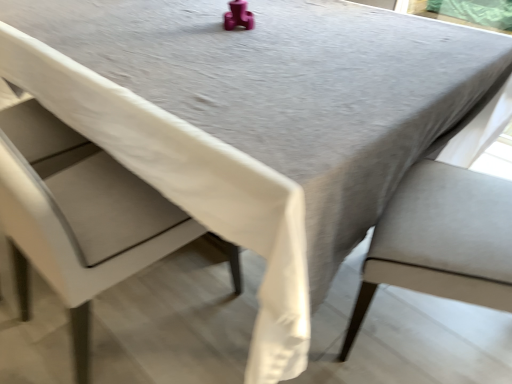
What do you see at coordinates (140, 195) in the screenshot?
I see `white fabric chair at left, which is counted as the first chair, starting from the left` at bounding box center [140, 195].

Locate an element on the screen. The height and width of the screenshot is (384, 512). white fabric chair at left, which is the second chair from right to left is located at coordinates (140, 195).

Find the location of a particular element. satin beige chair at right, marked as the 1th chair in a right-to-left arrangement is located at coordinates (441, 241).

This screenshot has height=384, width=512. What do you see at coordinates (441, 241) in the screenshot? I see `satin beige chair at right, which appears as the second chair when viewed from the left` at bounding box center [441, 241].

From the picture: How much space does satin beige chair at right, marked as the 1th chair in a right-to-left arrangement, occupy horizontally?

satin beige chair at right, marked as the 1th chair in a right-to-left arrangement, is 52.15 centimeters in width.

In order to face satin beige chair at right, marked as the 1th chair in a right-to-left arrangement, should I rotate leftwards or rightwards?

Rotate right and turn 28.306 degrees.

At what (x,y) coordinates should I click in order to perform the action: click on white fabric chair at left, which is counted as the first chair, starting from the left. Please return your answer as a coordinate pair (x, y). Looking at the image, I should click on (140, 195).

Which object is positioned more to the right, white fabric chair at left, which is counted as the first chair, starting from the left, or satin beige chair at right, marked as the 1th chair in a right-to-left arrangement?

Positioned to the right is satin beige chair at right, marked as the 1th chair in a right-to-left arrangement.

Does white fabric chair at left, which is counted as the first chair, starting from the left, come behind satin beige chair at right, which appears as the second chair when viewed from the left?

That is False.

Is point (86, 240) positioned behind point (468, 236)?

No, it is not.

From the image's perspective, who appears lower, white fabric chair at left, which is counted as the first chair, starting from the left, or satin beige chair at right, which appears as the second chair when viewed from the left?

satin beige chair at right, which appears as the second chair when viewed from the left, is shown below in the image.

From a real-world perspective, relative to satin beige chair at right, marked as the 1th chair in a right-to-left arrangement, is white fabric chair at left, which is counted as the first chair, starting from the left, vertically above or below?

From a real-world perspective, white fabric chair at left, which is counted as the first chair, starting from the left, is physically above satin beige chair at right, marked as the 1th chair in a right-to-left arrangement.

Between white fabric chair at left, which is the second chair from right to left, and satin beige chair at right, which appears as the second chair when viewed from the left, which one has larger width?

white fabric chair at left, which is the second chair from right to left, is wider.

Can you confirm if white fabric chair at left, which is counted as the first chair, starting from the left, is taller than satin beige chair at right, which appears as the second chair when viewed from the left?

Yes.

Based on their sizes in the image, would you say white fabric chair at left, which is counted as the first chair, starting from the left, is bigger or smaller than satin beige chair at right, which appears as the second chair when viewed from the left?

Considering their sizes, white fabric chair at left, which is counted as the first chair, starting from the left, takes up more space than satin beige chair at right, which appears as the second chair when viewed from the left.

Is satin beige chair at right, which appears as the second chair when viewed from the left, located within white fabric chair at left, which is the second chair from right to left?

No, satin beige chair at right, which appears as the second chair when viewed from the left, is not inside white fabric chair at left, which is the second chair from right to left.

Looking at this image, is white fabric chair at left, which is the second chair from right to left, not close to satin beige chair at right, which appears as the second chair when viewed from the left?

No, white fabric chair at left, which is the second chair from right to left, is in close proximity to satin beige chair at right, which appears as the second chair when viewed from the left.

Does white fabric chair at left, which is counted as the first chair, starting from the left, turn towards satin beige chair at right, marked as the 1th chair in a right-to-left arrangement?

No.

Based on the photo, could you measure the distance between white fabric chair at left, which is counted as the first chair, starting from the left, and satin beige chair at right, marked as the 1th chair in a right-to-left arrangement?

white fabric chair at left, which is counted as the first chair, starting from the left, is 23.42 inches from satin beige chair at right, marked as the 1th chair in a right-to-left arrangement.

Find the location of a particular element. This screenshot has height=384, width=512. chair located on the left of satin beige chair at right, which appears as the second chair when viewed from the left is located at coordinates (140, 195).

Is satin beige chair at right, which appears as the second chair when viewed from the left, to the right of white fabric chair at left, which is counted as the first chair, starting from the left, from the viewer's perspective?

Yes.

Is the depth of satin beige chair at right, marked as the 1th chair in a right-to-left arrangement, greater than that of white fabric chair at left, which is the second chair from right to left?

Yes, it is.

Is point (497, 228) closer to viewer compared to point (67, 274)?

No.

In the scene shown: From the image's perspective, relative to white fabric chair at left, which is the second chair from right to left, is satin beige chair at right, marked as the 1th chair in a right-to-left arrangement, above or below?

satin beige chair at right, marked as the 1th chair in a right-to-left arrangement, is situated lower than white fabric chair at left, which is the second chair from right to left, in the image.

From a real-world perspective, is satin beige chair at right, marked as the 1th chair in a right-to-left arrangement, below white fabric chair at left, which is the second chair from right to left?

Yes, from a real-world perspective, satin beige chair at right, marked as the 1th chair in a right-to-left arrangement, is under white fabric chair at left, which is the second chair from right to left.

Can you confirm if satin beige chair at right, which appears as the second chair when viewed from the left, is thinner than white fabric chair at left, which is the second chair from right to left?

Correct, the width of satin beige chair at right, which appears as the second chair when viewed from the left, is less than that of white fabric chair at left, which is the second chair from right to left.

Can you confirm if satin beige chair at right, which appears as the second chair when viewed from the left, is shorter than white fabric chair at left, which is the second chair from right to left?

Yes.

Considering the sizes of objects satin beige chair at right, which appears as the second chair when viewed from the left, and white fabric chair at left, which is counted as the first chair, starting from the left, in the image provided, who is smaller, satin beige chair at right, which appears as the second chair when viewed from the left, or white fabric chair at left, which is counted as the first chair, starting from the left,?

With smaller size is satin beige chair at right, which appears as the second chair when viewed from the left.

Can we say satin beige chair at right, which appears as the second chair when viewed from the left, lies outside white fabric chair at left, which is the second chair from right to left?

That's correct, satin beige chair at right, which appears as the second chair when viewed from the left, is outside of white fabric chair at left, which is the second chair from right to left.

Is satin beige chair at right, marked as the 1th chair in a right-to-left arrangement, not near white fabric chair at left, which is counted as the first chair, starting from the left?

That's not correct — satin beige chair at right, marked as the 1th chair in a right-to-left arrangement, is a little close to white fabric chair at left, which is counted as the first chair, starting from the left.

Is satin beige chair at right, which appears as the second chair when viewed from the left, positioned with its back to white fabric chair at left, which is the second chair from right to left?

No, satin beige chair at right, which appears as the second chair when viewed from the left,'s orientation is not away from white fabric chair at left, which is the second chair from right to left.

This screenshot has width=512, height=384. Identify the location of chair on the right of white fabric chair at left, which is the second chair from right to left. (441, 241).

The height and width of the screenshot is (384, 512). I want to click on chair located above the satin beige chair at right, which appears as the second chair when viewed from the left (from the image's perspective), so click(140, 195).

Where is `chair below the white fabric chair at left, which is counted as the first chair, starting from the left (from the image's perspective)`? This screenshot has width=512, height=384. chair below the white fabric chair at left, which is counted as the first chair, starting from the left (from the image's perspective) is located at coordinates (441, 241).